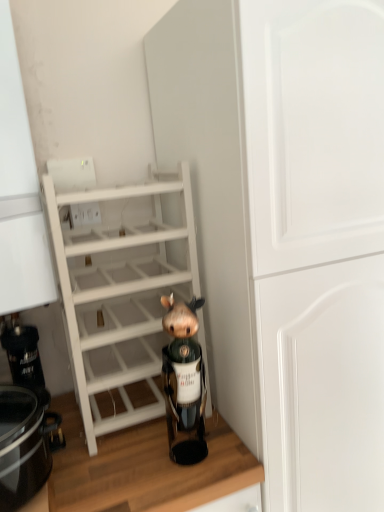
Question: From the image's perspective, is wooden at lower center located above or below brown matte figurine at center?

Choices:
 (A) below
 (B) above

Answer: (A)

Question: Considering the positions of wooden at lower center and brown matte figurine at center in the image, is wooden at lower center taller or shorter than brown matte figurine at center?

Choices:
 (A) tall
 (B) short

Answer: (A)

Question: Which object is the closest to the white wood shelf at center?

Choices:
 (A) wooden at lower center
 (B) brown matte figurine at center
 (C) white matte cabinet at center
 (D) black glossy crock pot at lower left

Answer: (B)

Question: Which object is positioned farthest from the black glossy crock pot at lower left?

Choices:
 (A) brown matte figurine at center
 (B) white matte cabinet at center
 (C) wooden at lower center
 (D) white wood shelf at center

Answer: (B)